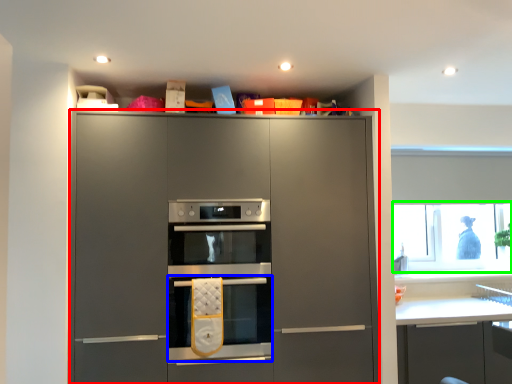
Question: Which object is positioned farthest from cabinetry (highlighted by a red box)? Select from oven (highlighted by a blue box) and window screen (highlighted by a green box).

Choices:
 (A) oven
 (B) window screen

Answer: (B)